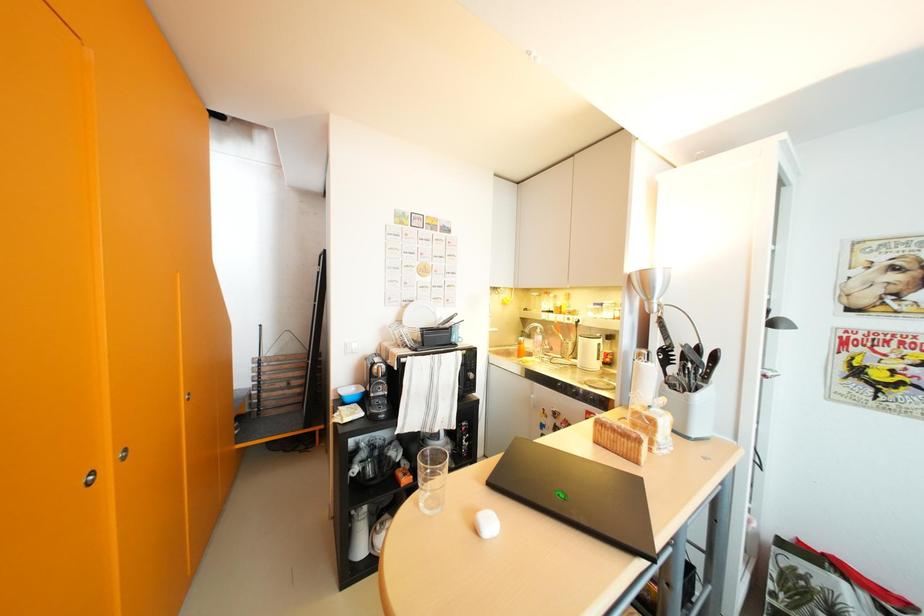
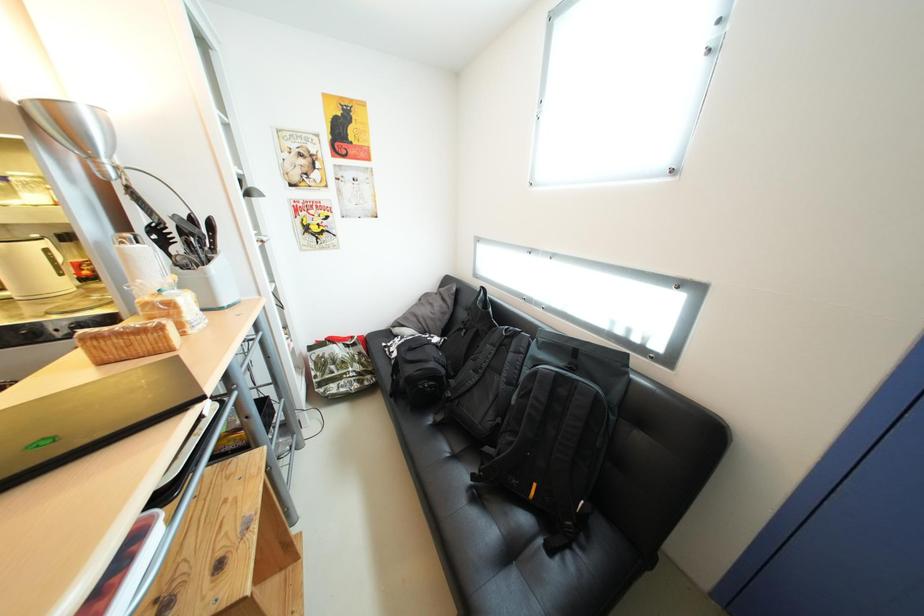
Based on the continuous images, in which direction is the camera rotating?

The camera's rotation is toward right-down.